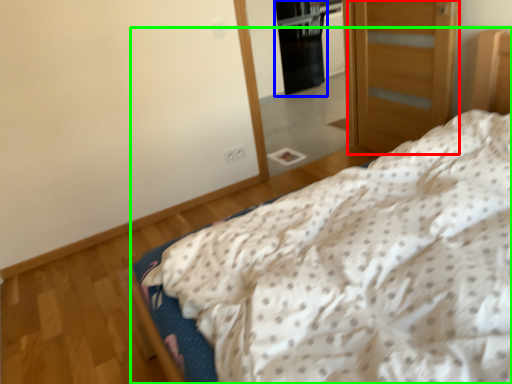
Question: Considering the real-world distances, which object is farthest from door (highlighted by a red box)? screen door (highlighted by a blue box) or bed (highlighted by a green box)?

Choices:
 (A) screen door
 (B) bed

Answer: (A)